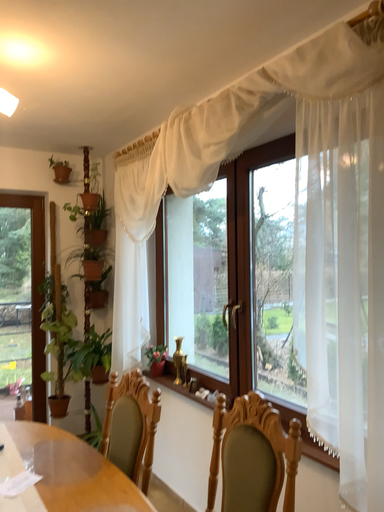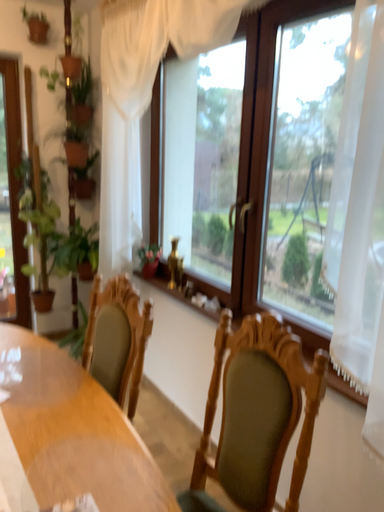
Question: Which way did the camera rotate in the video?

Choices:
 (A) rotated downward
 (B) rotated upward

Answer: (A)